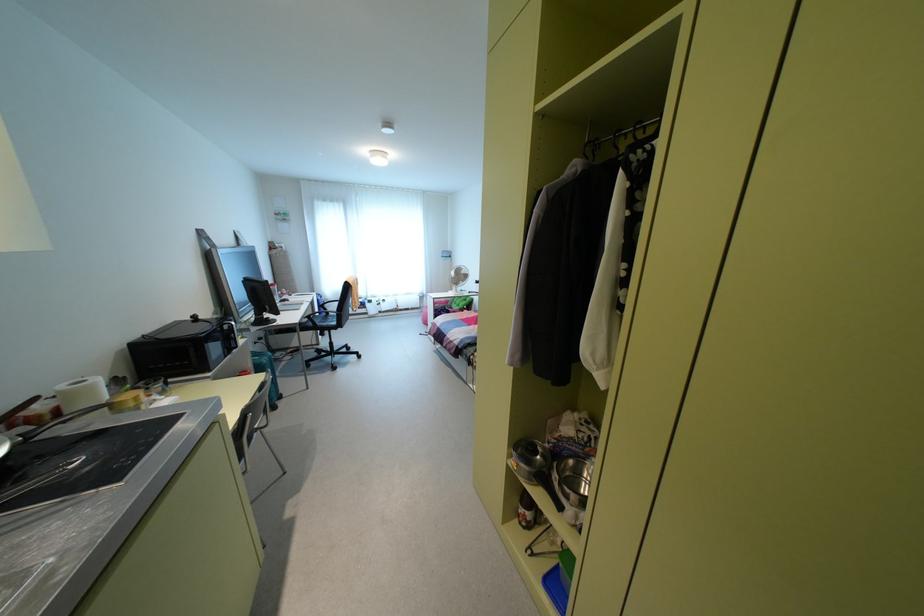
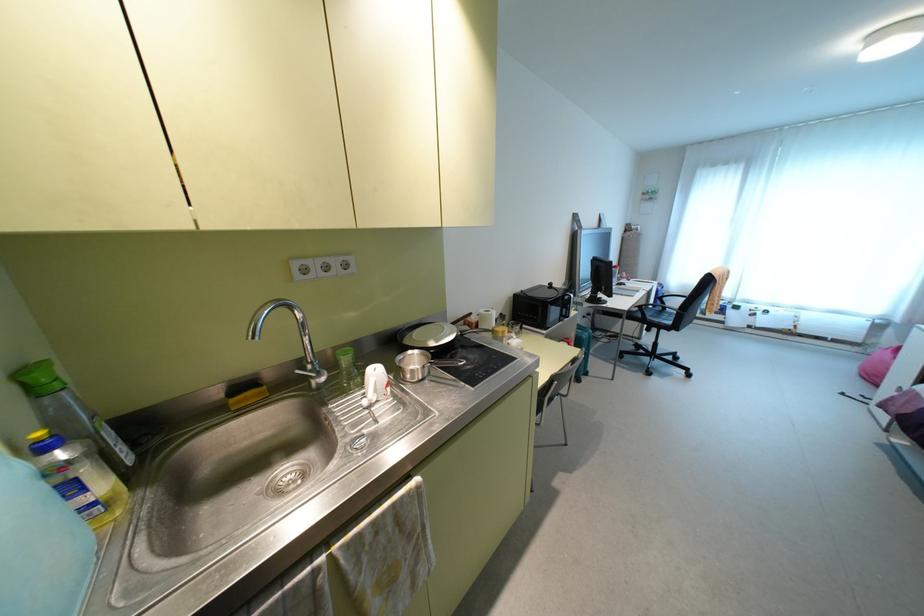
In the second image, find the point that corresponds to point (128, 395) in the first image.

(500, 328)